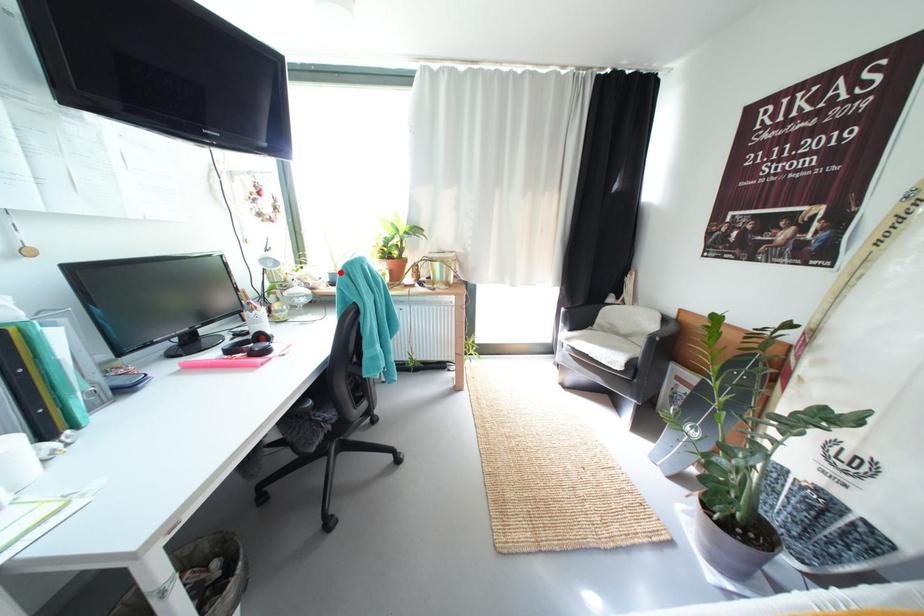
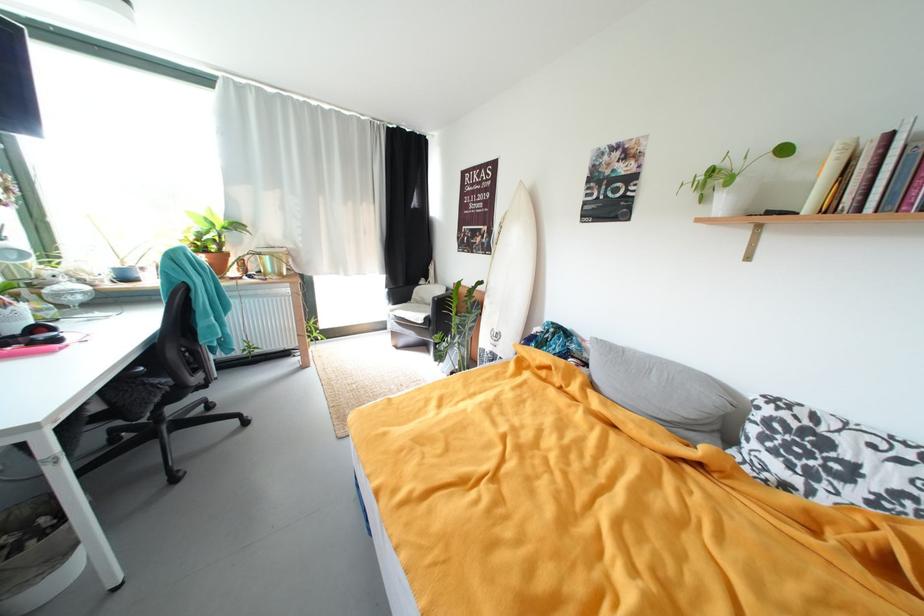
Question: A red point is marked in image1. In image2, is the corresponding 3D point closer to the camera or farther? Reply with the corresponding letter.

Choices:
 (A) The corresponding 3D point is closer.
 (B) The corresponding 3D point is farther.

Answer: (A)